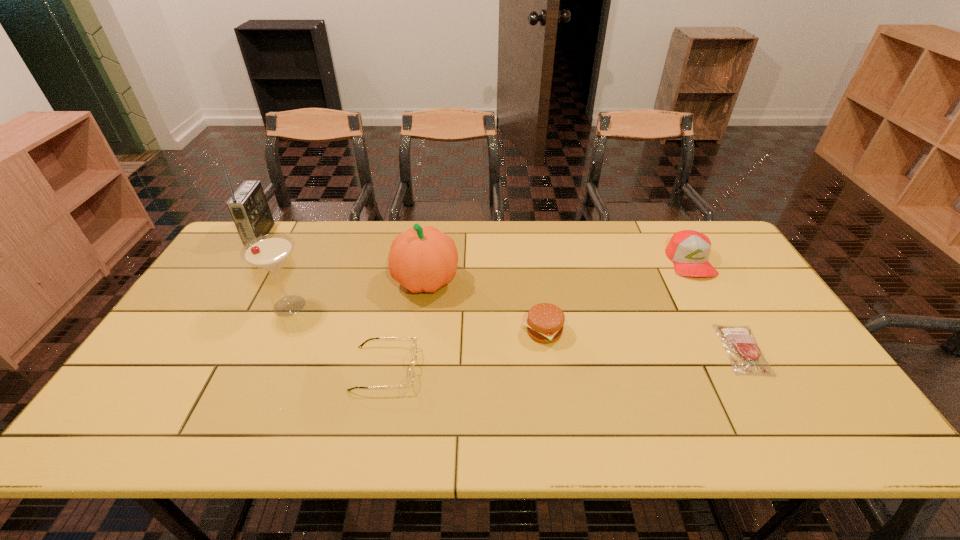
Identify the location of radio receiver. (248, 206).

I want to click on the leftmost object, so click(248, 206).

You are a GUI agent. You are given a task and a screenshot of the screen. Output one action in this format:
    pyautogui.click(x=<x>, y=<y>)
    Task: Click on the martini
    This screenshot has width=960, height=540.
    Given the screenshot: What is the action you would take?
    pyautogui.click(x=270, y=252)

Locate an element on the screen. The image size is (960, 540). pumpkin is located at coordinates (421, 259).

I want to click on the fourth tallest object, so click(689, 250).

You are a GUI agent. You are given a task and a screenshot of the screen. Output one action in this format:
    pyautogui.click(x=<x>, y=<y>)
    Task: Click on the third shortest object
    This screenshot has width=960, height=540.
    Given the screenshot: What is the action you would take?
    pyautogui.click(x=545, y=322)

Identify the location of hamburger. The width and height of the screenshot is (960, 540). (545, 322).

The image size is (960, 540). Find the location of `spectacles`. spectacles is located at coordinates (411, 372).

Identify the location of steak. (739, 342).

Find the location of a particular element. The image size is (960, 540). vacant point located 0.070m on the display of the leftmost object is located at coordinates (289, 235).